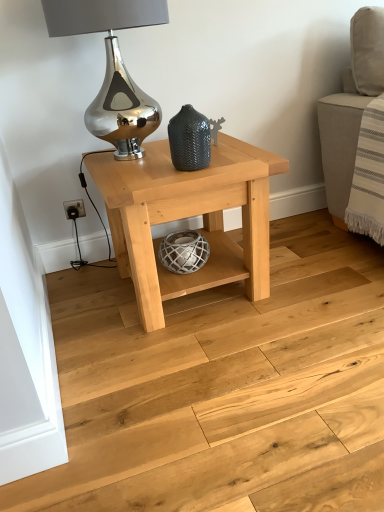
The width and height of the screenshot is (384, 512). Identify the location of vacant area that is in front of matte dark gray textured vase at center. (183, 179).